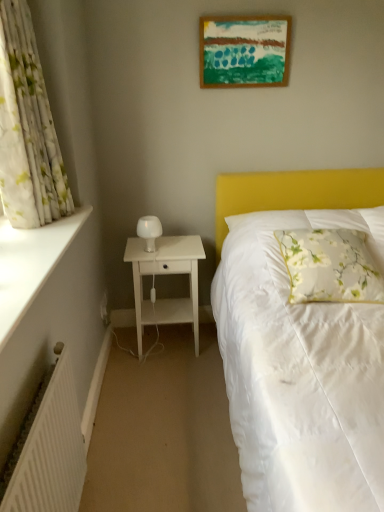
Question: Looking at their shapes, would you say white matte nightstand at left is wider or thinner than floral fabric pillow at right?

Choices:
 (A) thin
 (B) wide

Answer: (A)

Question: Looking at the image, does white matte nightstand at left seem bigger or smaller compared to floral fabric pillow at right?

Choices:
 (A) big
 (B) small

Answer: (A)

Question: Considering the real-world distances, which object is farthest from the white smooth window sill at left?

Choices:
 (A) wooden picture frame at upper center
 (B) white glossy bedside lamp at left
 (C) white floral fabric curtain at left
 (D) white ribbed radiator at lower left
 (E) white matte nightstand at left

Answer: (A)

Question: Which object is the farthest from the white floral fabric curtain at left?

Choices:
 (A) white smooth window sill at left
 (B) white matte nightstand at left
 (C) floral fabric pillow at right
 (D) white glossy bedside lamp at left
 (E) white ribbed radiator at lower left

Answer: (C)